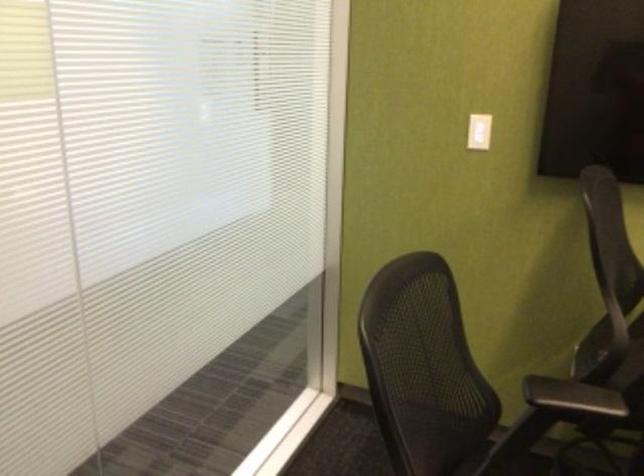
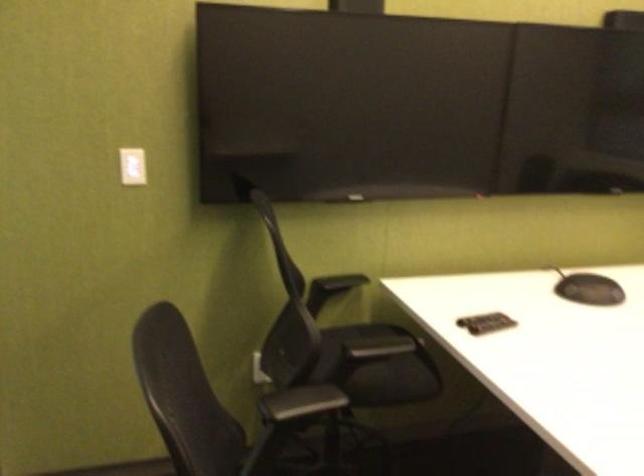
Question: Based on the continuous images, in which direction is the camera rotating? Reply with the corresponding letter.

Choices:
 (A) Left
 (B) Right
 (C) Up
 (D) Down

Answer: (B)